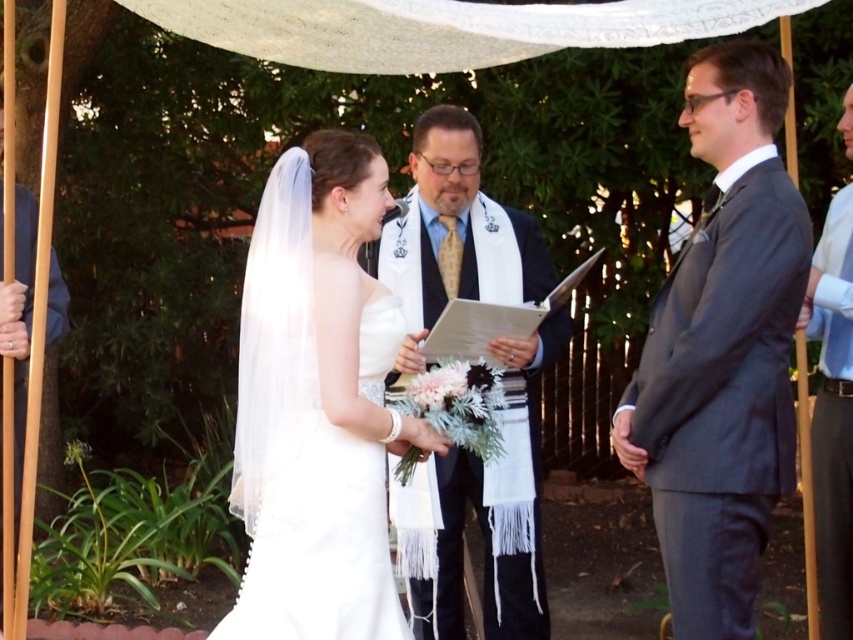
Question: Does light blue shirt at right have a greater width compared to white satin dress at left?

Choices:
 (A) yes
 (B) no

Answer: (B)

Question: Which point is closer to the camera?

Choices:
 (A) (538, 592)
 (B) (16, 272)

Answer: (B)

Question: Is white textured scarf at center below white satin dress at left?

Choices:
 (A) no
 (B) yes

Answer: (B)

Question: Is white satin dress at center behind light blue shirt at right?

Choices:
 (A) no
 (B) yes

Answer: (A)

Question: Which of these objects is positioned farthest from the white satin dress at center?

Choices:
 (A) light blue shirt at right
 (B) gray suit at right
 (C) white satin dress at left

Answer: (A)

Question: Which point is farther from the camera taking this photo?

Choices:
 (A) (837, 289)
 (B) (757, 385)

Answer: (A)